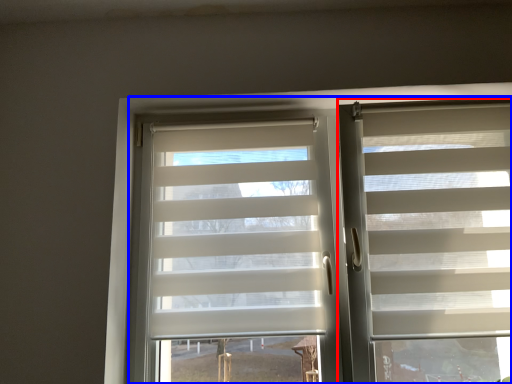
Question: Which object is closer to the camera taking this photo, window blind (highlighted by a red box) or bay window (highlighted by a blue box)?

Choices:
 (A) window blind
 (B) bay window

Answer: (A)